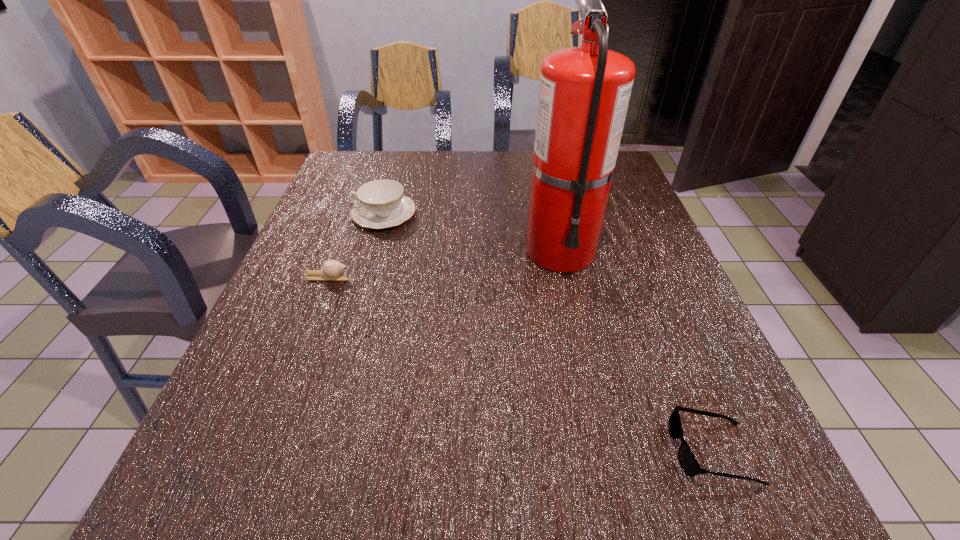
Image resolution: width=960 pixels, height=540 pixels. What are the coordinates of `vacant space located on the front-facing side of the sunglasses` in the screenshot? It's located at 470,451.

In order to click on vacant point located 0.230m on the front-facing side of the sunglasses in this screenshot , I will do click(x=527, y=451).

Where is `vacant space situated on the front-facing side of the sunglasses`? This screenshot has height=540, width=960. vacant space situated on the front-facing side of the sunglasses is located at coordinates (565, 451).

Locate an element on the screen. object at the near edge is located at coordinates (687, 460).

This screenshot has height=540, width=960. I want to click on chinaware that is at the left edge, so click(381, 204).

This screenshot has height=540, width=960. What are the coordinates of `escargot present at the left edge` in the screenshot? It's located at (331, 270).

Where is `object that is at the right edge`? Image resolution: width=960 pixels, height=540 pixels. object that is at the right edge is located at coordinates (687, 460).

Where is `object at the near right corner`? Image resolution: width=960 pixels, height=540 pixels. object at the near right corner is located at coordinates (687, 460).

Find the location of a particular element. Image resolution: width=960 pixels, height=540 pixels. blank space at the far edge of the desktop is located at coordinates (472, 187).

Find the location of a particular element. The height and width of the screenshot is (540, 960). vacant space at the near edge of the desktop is located at coordinates (359, 495).